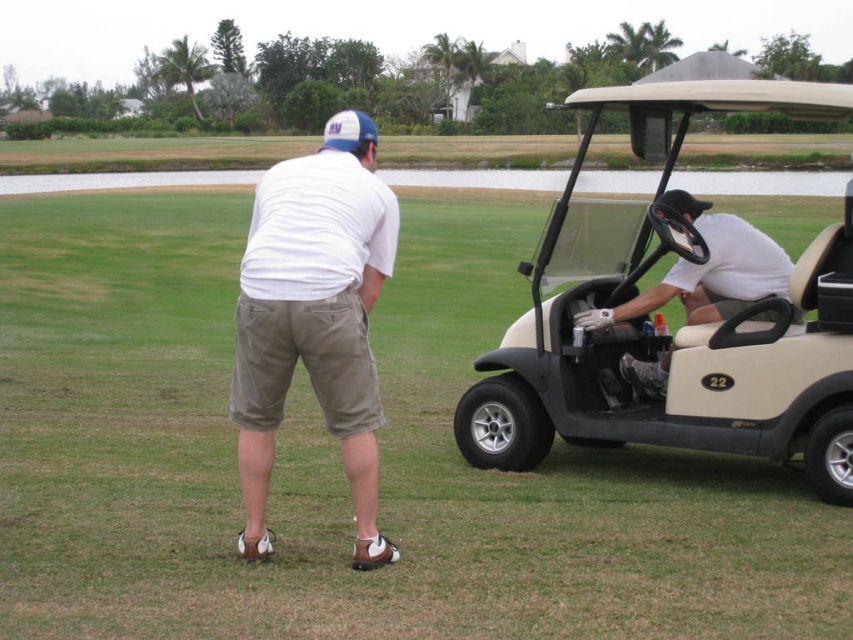
You are a golfer standing near the beige matte golf cart at right and the blue fabric baseball cap at upper center. You want to place a 10 meter long flag between them. Will the flag fit between them without overlapping either object?

The distance between the beige matte golf cart at right and the blue fabric baseball cap at upper center is 13.66 meters. Since the flag is 10 meters long, it will fit between them without overlapping either object as there is enough space.

You are a golfer standing near the beige matte golf cart at right and the white cotton shirt at center. Which object is positioned higher from the ground?

The beige matte golf cart at right is located above the white cotton shirt at center, so it is positioned higher from the ground.

Looking at this image, you are a golfer who wants to know if your new golf cart can fit into your garage. The garage has a space that can accommodate objects the same size as the white cotton shirt at center. Can the beige matte golf cart at right fit into the garage space?

The beige matte golf cart at right is larger in size than the white cotton shirt at center, so it cannot fit into the garage space designed for objects of the shirt size.